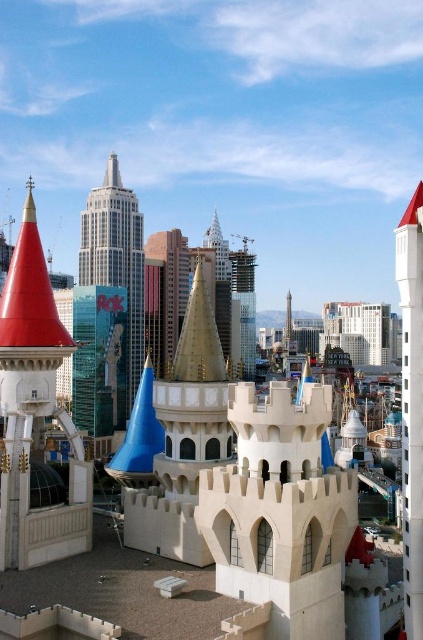
Question: Does red matte cone at upper left come behind white glass skyscraper at center?

Choices:
 (A) yes
 (B) no

Answer: (B)

Question: Does white concrete tower at right come in front of white glass skyscraper at center?

Choices:
 (A) yes
 (B) no

Answer: (A)

Question: In this image, where is white glass skyscraper at center located relative to clear glass tower at center?

Choices:
 (A) above
 (B) below

Answer: (A)

Question: Which of these objects is positioned farthest from the red matte cone at upper left?

Choices:
 (A) clear glass tower at center
 (B) white concrete tower at right
 (C) white glass skyscraper at center

Answer: (A)

Question: Considering the real-world distances, which object is closest to the red matte cone at upper left?

Choices:
 (A) white glass skyscraper at center
 (B) clear glass tower at center

Answer: (A)

Question: Which object appears closest to the camera in this image?

Choices:
 (A) red matte cone at upper left
 (B) clear glass tower at center

Answer: (A)